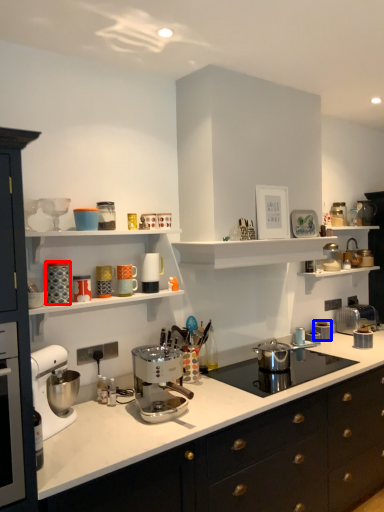
Question: Which object is closer to the camera taking this photo, kitchen appliance (highlighted by a red box) or kitchen appliance (highlighted by a blue box)?

Choices:
 (A) kitchen appliance
 (B) kitchen appliance

Answer: (A)